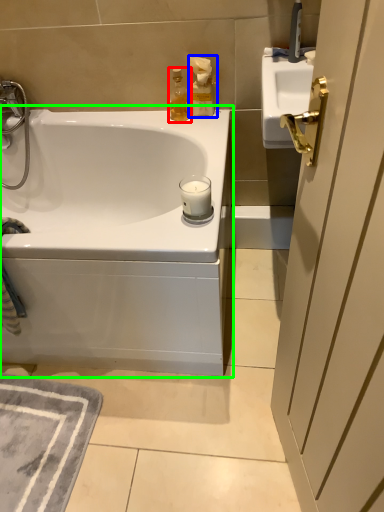
Question: Based on their relative distances, which object is farther from soap dispenser (highlighted by a red box)? Choose from bottle (highlighted by a blue box) and bathtub (highlighted by a green box).

Choices:
 (A) bottle
 (B) bathtub

Answer: (B)